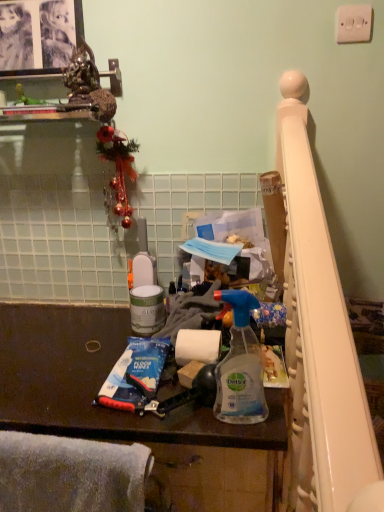
At what (x,y) coordinates should I click in order to perform the action: click on blank space to the left of white glossy paint can at center. Please return your answer as a coordinate pair (x, y). Looking at the image, I should click on (89, 340).